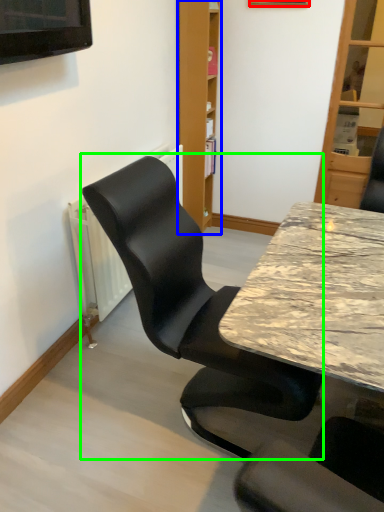
Question: Which is farther away from picture frame (highlighted by a red box)? bookshelf (highlighted by a blue box) or chair (highlighted by a green box)?

Choices:
 (A) bookshelf
 (B) chair

Answer: (B)